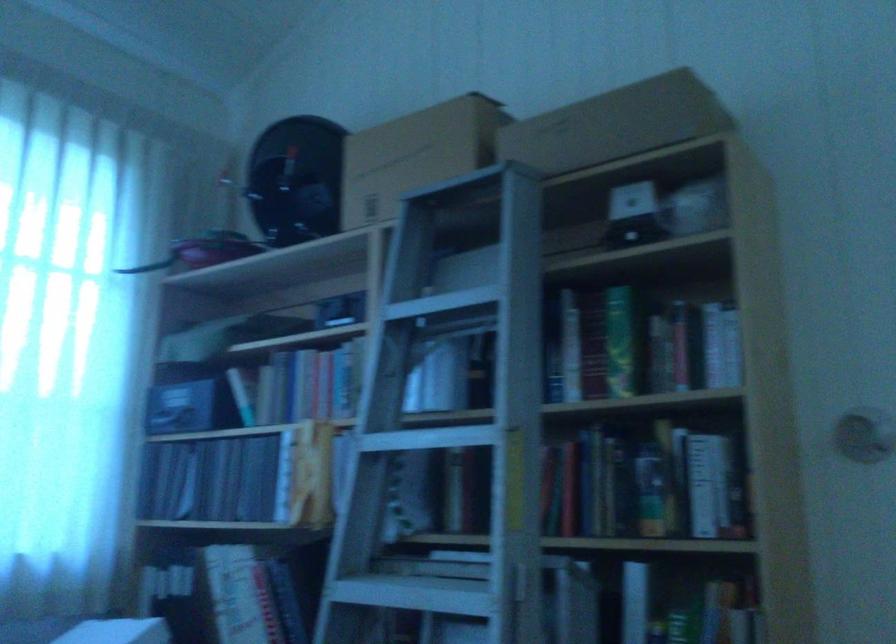
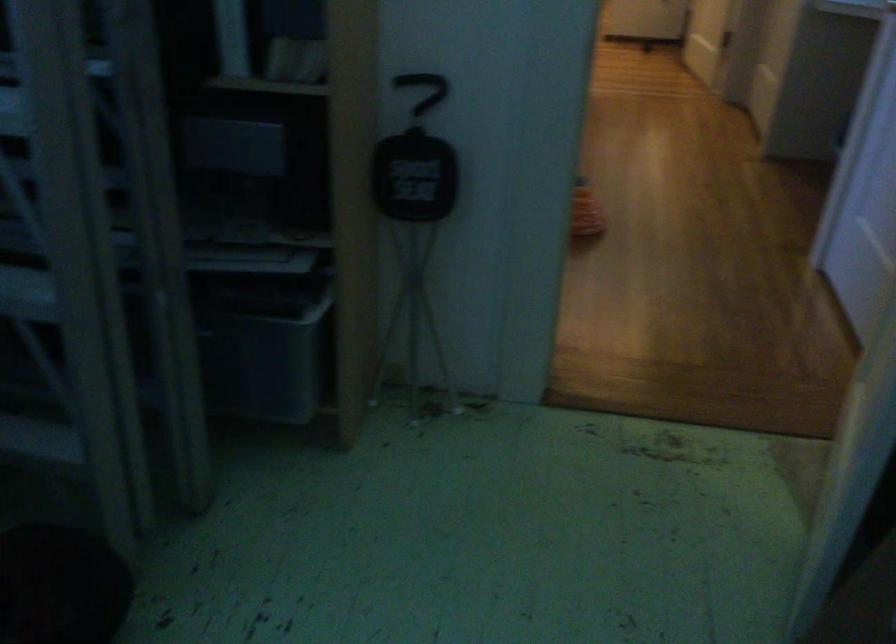
The first image is from the beginning of the video and the second image is from the end. How did the camera likely rotate when shooting the video?

The rotation direction of the camera is right-down.